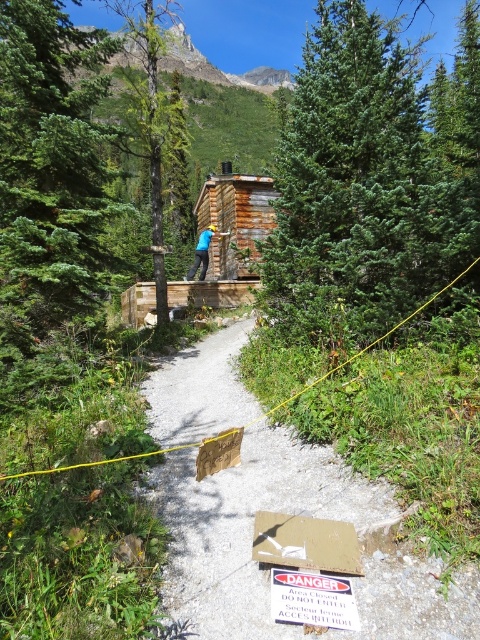
You are standing on the gravel path at center and want to reach the green fir tree at center. Which direction should you move to get closer to the tree?

Since the green fir tree at center is closer to you than the gravel path at center, you are already on the path leading towards the tree. Move forward along the gravel path at center to reach the green fir tree at center.

You are a hiker standing on the gravel pathway in the foreground. You see a green fir tree at center and a dark brown bark tree at center. Which tree is taller?

The dark brown bark tree at center is taller than the green fir tree at center.